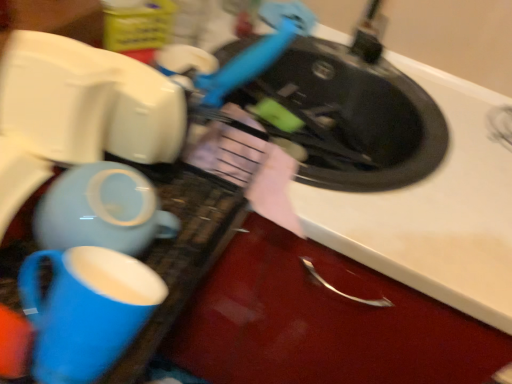
Question: Is matte ceramic mug at lower left inside white matte sink at upper right?

Choices:
 (A) yes
 (B) no

Answer: (B)

Question: Can you confirm if white matte sink at upper right is shorter than matte ceramic mug at lower left?

Choices:
 (A) yes
 (B) no

Answer: (B)

Question: Does white matte sink at upper right turn towards matte ceramic mug at lower left?

Choices:
 (A) no
 (B) yes

Answer: (B)

Question: Does white matte sink at upper right have a smaller size compared to matte ceramic mug at lower left?

Choices:
 (A) no
 (B) yes

Answer: (A)

Question: From a real-world perspective, is white matte sink at upper right over matte ceramic mug at lower left?

Choices:
 (A) yes
 (B) no

Answer: (B)

Question: Based on their positions, is matte ceramic teapot at lower left located to the left or right of matte ceramic mug at lower left?

Choices:
 (A) right
 (B) left

Answer: (B)

Question: From a real-world perspective, is matte ceramic teapot at lower left above or below matte ceramic mug at lower left?

Choices:
 (A) above
 (B) below

Answer: (A)

Question: Is matte ceramic teapot at lower left spatially inside matte ceramic mug at lower left, or outside of it?

Choices:
 (A) outside
 (B) inside

Answer: (A)

Question: Considering the positions of matte ceramic teapot at lower left and matte ceramic mug at lower left in the image, is matte ceramic teapot at lower left bigger or smaller than matte ceramic mug at lower left?

Choices:
 (A) small
 (B) big

Answer: (B)

Question: Considering their positions, is matte ceramic mug at lower left located in front of or behind matte ceramic teapot at lower left?

Choices:
 (A) front
 (B) behind

Answer: (A)

Question: Considering the relative positions of matte ceramic mug at lower left and matte ceramic teapot at lower left in the image provided, is matte ceramic mug at lower left to the left or to the right of matte ceramic teapot at lower left?

Choices:
 (A) left
 (B) right

Answer: (B)

Question: From the image's perspective, is matte ceramic mug at lower left above or below matte ceramic teapot at lower left?

Choices:
 (A) above
 (B) below

Answer: (B)

Question: In terms of width, does matte ceramic mug at lower left look wider or thinner when compared to matte ceramic teapot at lower left?

Choices:
 (A) thin
 (B) wide

Answer: (A)

Question: From a real-world perspective, is white matte sink at upper right positioned above or below matte ceramic mug at lower left?

Choices:
 (A) above
 (B) below

Answer: (B)

Question: In terms of size, does white matte sink at upper right appear bigger or smaller than matte ceramic mug at lower left?

Choices:
 (A) big
 (B) small

Answer: (A)